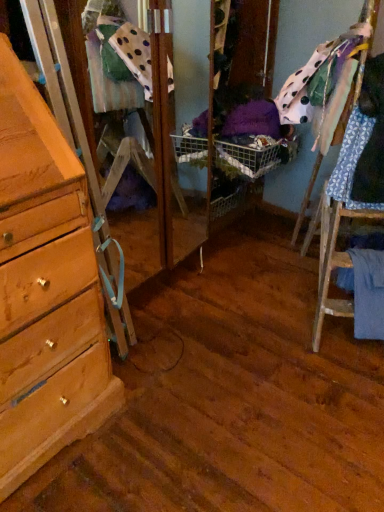
How much space does blue fabric at lower right, which is counted as the first clothing, starting from the bottom, occupy vertically?

blue fabric at lower right, which is counted as the first clothing, starting from the bottom, is 36.80 centimeters tall.

Where is `blue patterned fabric at right, which is the second clothing in bottom-to-top order`? The image size is (384, 512). blue patterned fabric at right, which is the second clothing in bottom-to-top order is located at coordinates (351, 160).

Could you tell me if blue fabric at lower right, marked as the third clothing in a top-to-bottom arrangement, is turned towards blue patterned fabric at right, which is the second clothing in bottom-to-top order?

No.

Which is behind, point (380, 257) or point (355, 206)?

The point (355, 206) is farther.

Can you confirm if blue fabric at lower right, marked as the third clothing in a top-to-bottom arrangement, is bigger than blue patterned fabric at right, which is the second clothing in bottom-to-top order?

Incorrect, blue fabric at lower right, marked as the third clothing in a top-to-bottom arrangement, is not larger than blue patterned fabric at right, which is the second clothing in bottom-to-top order.

From a real-world perspective, is blue fabric at lower right, marked as the third clothing in a top-to-bottom arrangement, beneath blue patterned fabric at right, the second clothing from the top?

Yes.

Looking at this image, between polka dot fabric at upper right, the 3th clothing ordered from the bottom, and blue fabric at lower right, which is counted as the first clothing, starting from the bottom, which one has less height?

With less height is polka dot fabric at upper right, the 3th clothing ordered from the bottom.

Which is more to the right, polka dot fabric at upper right, the 3th clothing ordered from the bottom, or blue fabric at lower right, which is counted as the first clothing, starting from the bottom?

From the viewer's perspective, blue fabric at lower right, which is counted as the first clothing, starting from the bottom, appears more on the right side.

Can you confirm if polka dot fabric at upper right, placed as the first clothing when sorted from top to bottom, is wider than blue fabric at lower right, which is counted as the first clothing, starting from the bottom?

Indeed, polka dot fabric at upper right, placed as the first clothing when sorted from top to bottom, has a greater width compared to blue fabric at lower right, which is counted as the first clothing, starting from the bottom.

From a real-world perspective, is polka dot fabric at upper right, placed as the first clothing when sorted from top to bottom, physically below blue fabric at lower right, which is counted as the first clothing, starting from the bottom?

Incorrect, from a real-world perspective, polka dot fabric at upper right, placed as the first clothing when sorted from top to bottom, is higher than blue fabric at lower right, which is counted as the first clothing, starting from the bottom.

Is blue patterned fabric at right, the second clothing from the top, wider than blue fabric at lower right, which is counted as the first clothing, starting from the bottom?

Incorrect, the width of blue patterned fabric at right, the second clothing from the top, does not surpass that of blue fabric at lower right, which is counted as the first clothing, starting from the bottom.

Does blue patterned fabric at right, the second clothing from the top, have a larger size compared to blue fabric at lower right, marked as the third clothing in a top-to-bottom arrangement?

Yes, blue patterned fabric at right, the second clothing from the top, is bigger than blue fabric at lower right, marked as the third clothing in a top-to-bottom arrangement.

Locate an element on the screen. Image resolution: width=384 pixels, height=512 pixels. the 2nd clothing behind the blue patterned fabric at right, which is the second clothing in bottom-to-top order, counting from the anchor's position is located at coordinates (367, 292).

Does point (353, 147) come behind point (361, 334)?

No, (353, 147) is closer to viewer.

Between blue fabric at lower right, marked as the third clothing in a top-to-bottom arrangement, and polka dot fabric at upper right, the 3th clothing ordered from the bottom, which one has larger size?

polka dot fabric at upper right, the 3th clothing ordered from the bottom.

From the image's perspective, is blue fabric at lower right, marked as the third clothing in a top-to-bottom arrangement, positioned above or below polka dot fabric at upper right, placed as the first clothing when sorted from top to bottom?

blue fabric at lower right, marked as the third clothing in a top-to-bottom arrangement, is below polka dot fabric at upper right, placed as the first clothing when sorted from top to bottom.

From a real-world perspective, who is located higher, blue fabric at lower right, which is counted as the first clothing, starting from the bottom, or polka dot fabric at upper right, placed as the first clothing when sorted from top to bottom?

polka dot fabric at upper right, placed as the first clothing when sorted from top to bottom.

Between blue fabric at lower right, which is counted as the first clothing, starting from the bottom, and polka dot fabric at upper right, placed as the first clothing when sorted from top to bottom, which one has smaller width?

With smaller width is blue fabric at lower right, which is counted as the first clothing, starting from the bottom.

Considering the relative sizes of polka dot fabric at upper right, the 3th clothing ordered from the bottom, and blue patterned fabric at right, the second clothing from the top, in the image provided, is polka dot fabric at upper right, the 3th clothing ordered from the bottom, wider than blue patterned fabric at right, the second clothing from the top,?

Correct, the width of polka dot fabric at upper right, the 3th clothing ordered from the bottom, exceeds that of blue patterned fabric at right, the second clothing from the top.

From the picture: Between polka dot fabric at upper right, placed as the first clothing when sorted from top to bottom, and blue patterned fabric at right, which is the second clothing in bottom-to-top order, which one has less height?

Standing shorter between the two is blue patterned fabric at right, which is the second clothing in bottom-to-top order.

Is the position of polka dot fabric at upper right, the 3th clothing ordered from the bottom, more distant than that of blue patterned fabric at right, the second clothing from the top?

Yes, polka dot fabric at upper right, the 3th clothing ordered from the bottom, is further from the camera.

From the image's perspective, who appears lower, polka dot fabric at upper right, placed as the first clothing when sorted from top to bottom, or blue patterned fabric at right, which is the second clothing in bottom-to-top order?

blue patterned fabric at right, which is the second clothing in bottom-to-top order, from the image's perspective.

From a real-world perspective, is blue patterned fabric at right, the second clothing from the top, on top of polka dot fabric at upper right, the 3th clothing ordered from the bottom?

No, from a real-world perspective, blue patterned fabric at right, the second clothing from the top, is not above polka dot fabric at upper right, the 3th clothing ordered from the bottom.

Does blue patterned fabric at right, the second clothing from the top, come behind polka dot fabric at upper right, placed as the first clothing when sorted from top to bottom?

No, blue patterned fabric at right, the second clothing from the top, is closer to the camera.

Considering the sizes of blue patterned fabric at right, which is the second clothing in bottom-to-top order, and polka dot fabric at upper right, placed as the first clothing when sorted from top to bottom, in the image, is blue patterned fabric at right, which is the second clothing in bottom-to-top order, taller or shorter than polka dot fabric at upper right, placed as the first clothing when sorted from top to bottom,?

blue patterned fabric at right, which is the second clothing in bottom-to-top order, is shorter than polka dot fabric at upper right, placed as the first clothing when sorted from top to bottom.

Is polka dot fabric at upper right, placed as the first clothing when sorted from top to bottom, at the back of blue patterned fabric at right, the second clothing from the top?

That's not correct — blue patterned fabric at right, the second clothing from the top, is not looking away from polka dot fabric at upper right, placed as the first clothing when sorted from top to bottom.

The height and width of the screenshot is (512, 384). What are the coordinates of `the 2nd clothing behind the blue patterned fabric at right, which is the second clothing in bottom-to-top order, counting from the anchor's position` in the screenshot? It's located at (367, 292).

The image size is (384, 512). I want to click on the 2nd clothing positioned above the blue fabric at lower right, which is counted as the first clothing, starting from the bottom (from the image's perspective), so click(x=323, y=85).

Which object lies further to the anchor point polka dot fabric at upper right, placed as the first clothing when sorted from top to bottom, blue patterned fabric at right, the second clothing from the top, or blue fabric at lower right, which is counted as the first clothing, starting from the bottom?

blue fabric at lower right, which is counted as the first clothing, starting from the bottom, is positioned further to the anchor polka dot fabric at upper right, placed as the first clothing when sorted from top to bottom.

Which object lies nearer to the anchor point blue fabric at lower right, which is counted as the first clothing, starting from the bottom, polka dot fabric at upper right, placed as the first clothing when sorted from top to bottom, or blue patterned fabric at right, the second clothing from the top?

blue patterned fabric at right, the second clothing from the top, lies closer to blue fabric at lower right, which is counted as the first clothing, starting from the bottom, than the other object.

Estimate the real-world distances between objects in this image. Which object is closer to blue fabric at lower right, which is counted as the first clothing, starting from the bottom, blue patterned fabric at right, the second clothing from the top, or polka dot fabric at upper right, placed as the first clothing when sorted from top to bottom?

blue patterned fabric at right, the second clothing from the top.

From the image, which object appears to be nearer to polka dot fabric at upper right, the 3th clothing ordered from the bottom, blue fabric at lower right, which is counted as the first clothing, starting from the bottom, or blue patterned fabric at right, which is the second clothing in bottom-to-top order?

Among the two, blue patterned fabric at right, which is the second clothing in bottom-to-top order, is located nearer to polka dot fabric at upper right, the 3th clothing ordered from the bottom.

Looking at the image, which one is located further to blue patterned fabric at right, the second clothing from the top, blue fabric at lower right, marked as the third clothing in a top-to-bottom arrangement, or polka dot fabric at upper right, placed as the first clothing when sorted from top to bottom?

blue fabric at lower right, marked as the third clothing in a top-to-bottom arrangement, is further to blue patterned fabric at right, the second clothing from the top.

Estimate the real-world distances between objects in this image. Which object is closer to blue patterned fabric at right, the second clothing from the top, polka dot fabric at upper right, the 3th clothing ordered from the bottom, or blue fabric at lower right, marked as the third clothing in a top-to-bottom arrangement?

The object closer to blue patterned fabric at right, the second clothing from the top, is polka dot fabric at upper right, the 3th clothing ordered from the bottom.

You are a GUI agent. You are given a task and a screenshot of the screen. Output one action in this format:
    pyautogui.click(x=<x>, y=<y>)
    Task: Click on the clothing between polka dot fabric at upper right, the 3th clothing ordered from the bottom, and blue fabric at lower right, marked as the third clothing in a top-to-bottom arrangement, vertically
    This screenshot has height=512, width=384.
    Given the screenshot: What is the action you would take?
    pyautogui.click(x=351, y=160)